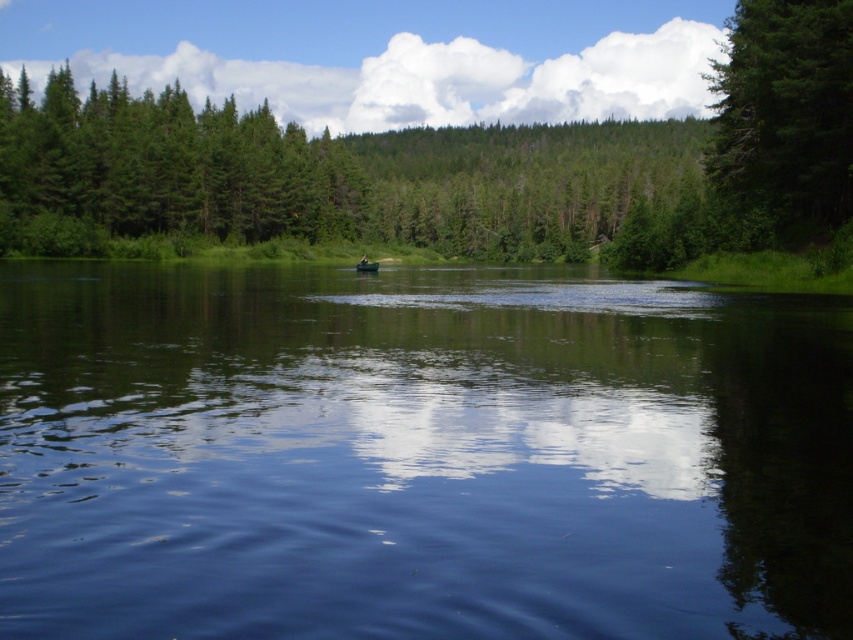
Question: Is transparent blue water at center smaller than green matte tree at upper right?

Choices:
 (A) no
 (B) yes

Answer: (B)

Question: Can you confirm if transparent blue water at center is wider than green matte tree at upper right?

Choices:
 (A) no
 (B) yes

Answer: (A)

Question: Which point is closer to the camera?

Choices:
 (A) [x=790, y=454]
 (B) [x=741, y=28]

Answer: (A)

Question: Which object is farther from the camera taking this photo?

Choices:
 (A) transparent blue water at center
 (B) green matte tree at upper right

Answer: (B)

Question: Does transparent blue water at center appear over green matte tree at upper right?

Choices:
 (A) yes
 (B) no

Answer: (B)

Question: Which of the following is the farthest from the observer?

Choices:
 (A) (808, 140)
 (B) (439, 588)

Answer: (A)